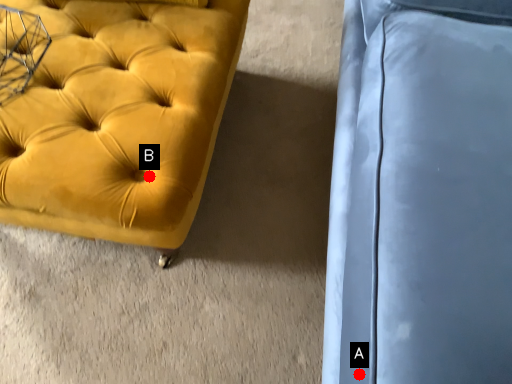
Question: Two points are circled on the image, labeled by A and B beside each circle. Among these points, which one is farthest from the camera?

Choices:
 (A) A is further
 (B) B is further

Answer: (B)